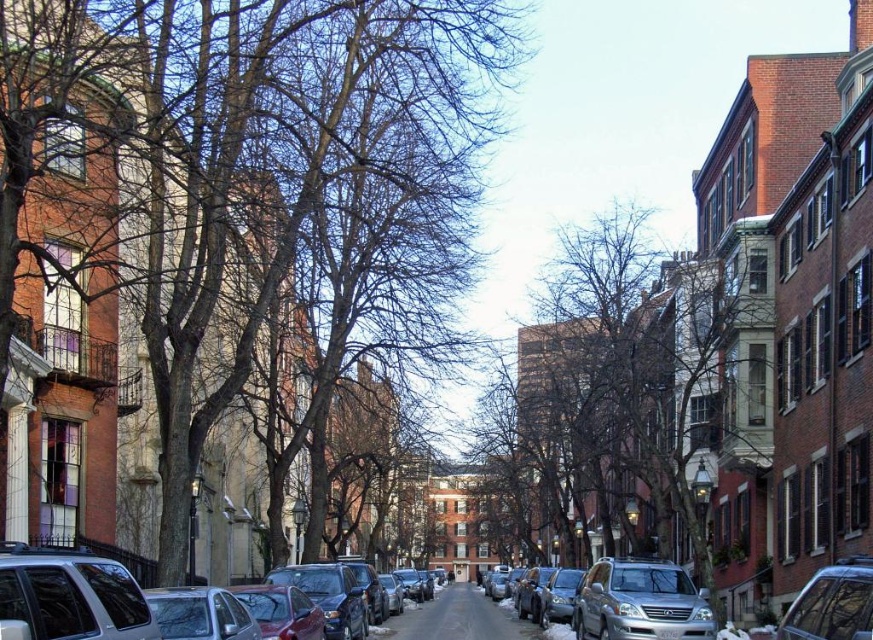
Question: Estimate the real-world distances between objects in this image. Which object is farther from the silver metallic suv at center?

Choices:
 (A) metallic silver car at lower right
 (B) matte silver suv at lower left
 (C) metallic silver car at lower left

Answer: (B)

Question: Is smooth brown tree at center smaller than silver metallic suv at center?

Choices:
 (A) no
 (B) yes

Answer: (A)

Question: Does matte silver suv at lower left appear on the left side of silver metallic suv at center?

Choices:
 (A) no
 (B) yes

Answer: (B)

Question: Does brown textured tree at left appear on the left side of matte silver suv at lower left?

Choices:
 (A) no
 (B) yes

Answer: (B)

Question: Which is nearer to the metallic silver car at lower right?

Choices:
 (A) silver metallic suv at center
 (B) brown textured tree at left
 (C) matte silver suv at lower left

Answer: (C)

Question: Which is nearer to the metallic silver car at lower left?

Choices:
 (A) matte silver suv at lower left
 (B) smooth brown tree at center

Answer: (A)